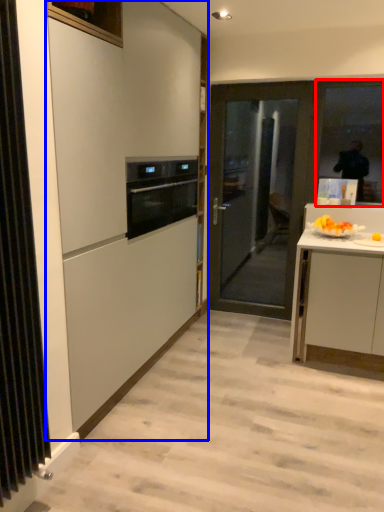
Question: Which point is further to the camera, window (highlighted by a red box) or cabinetry (highlighted by a blue box)?

Choices:
 (A) window
 (B) cabinetry

Answer: (A)